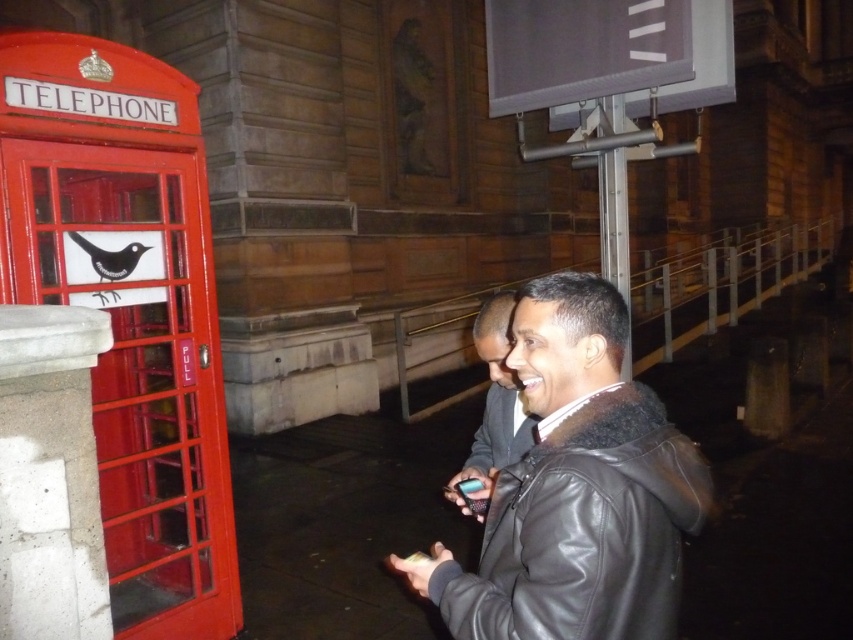
Question: Which point is farther to the camera?

Choices:
 (A) black leather jacket at center
 (B) leather jacket at center

Answer: (B)

Question: Does black leather jacket at center come behind leather jacket at center?

Choices:
 (A) yes
 (B) no

Answer: (B)

Question: Is black leather jacket at center above leather jacket at center?

Choices:
 (A) no
 (B) yes

Answer: (B)

Question: Which of the following is the farthest from the observer?

Choices:
 (A) (506, 576)
 (B) (488, 474)

Answer: (B)

Question: From the image, what is the correct spatial relationship of black leather jacket at center in relation to leather jacket at center?

Choices:
 (A) right
 (B) left

Answer: (A)